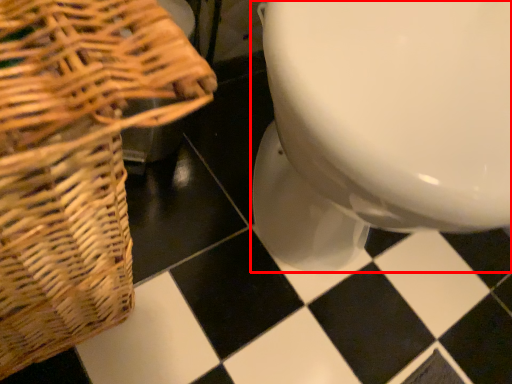
Question: From the image's perspective, what is the correct spatial relationship of toilet (annotated by the red box) in relation to picnic basket?

Choices:
 (A) below
 (B) above

Answer: (B)